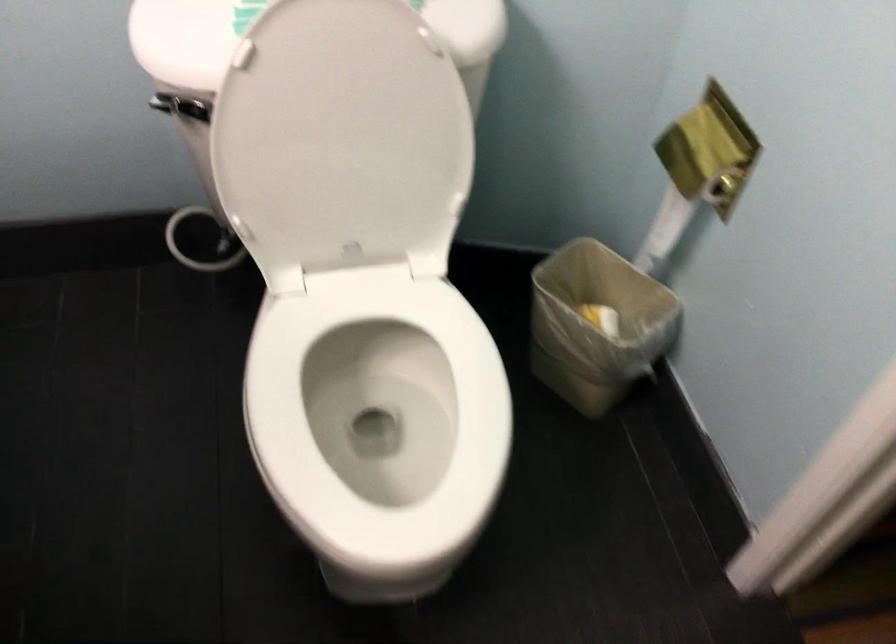
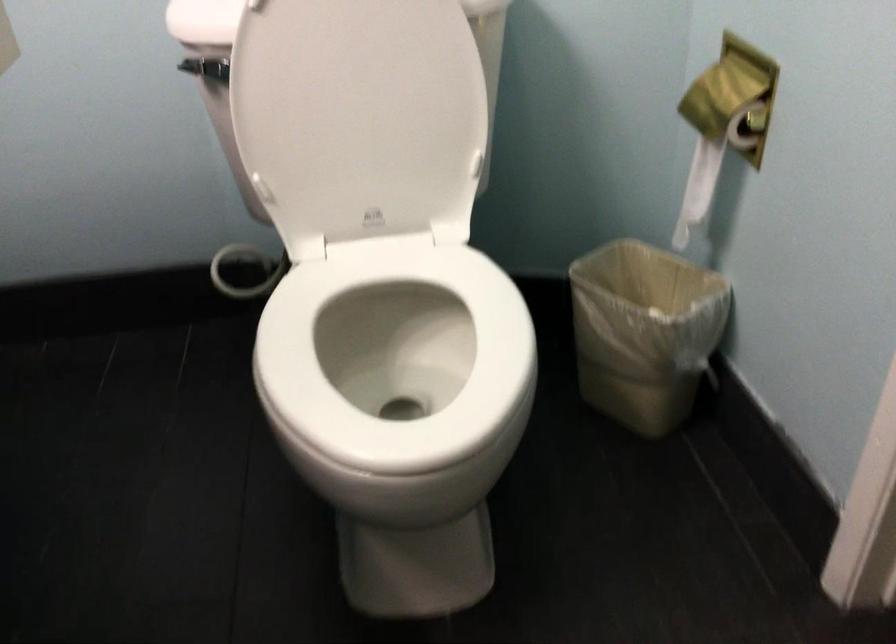
Locate, in the second image, the point that corresponds to pixel 703 147 in the first image.

(722, 91)